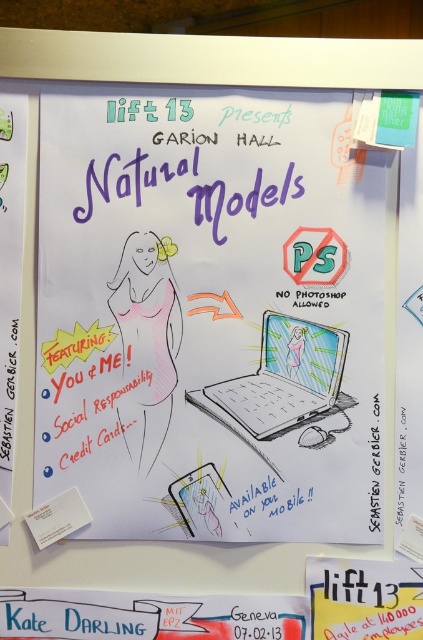
Question: Based on their relative distances, which object is nearer to the pink paper-like at center?

Choices:
 (A) matte gray laptop at center
 (B) white paper at center

Answer: (A)

Question: Is white paperboard at center above pink paper-like at center?

Choices:
 (A) no
 (B) yes

Answer: (B)

Question: Does pink paper-like at center lie behind white paper at center?

Choices:
 (A) yes
 (B) no

Answer: (A)

Question: Which point is closer to the camera?

Choices:
 (A) white paper at center
 (B) white paperboard at center

Answer: (A)

Question: Which of the following is the farthest from the observer?

Choices:
 (A) (255, 476)
 (B) (167, 292)

Answer: (B)

Question: Is pink paper-like at center positioned in front of white paper at center?

Choices:
 (A) no
 (B) yes

Answer: (A)